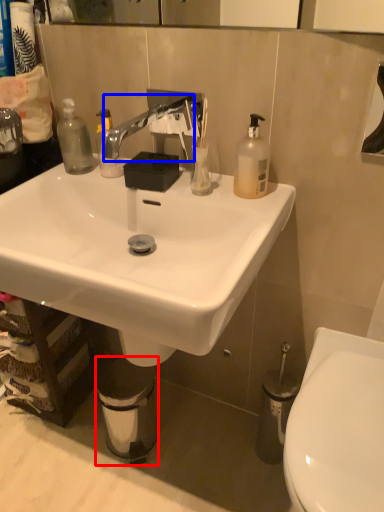
Question: Which of the following is the farthest to the observer, trash bin/can (highlighted by a red box) or faucet (highlighted by a blue box)?

Choices:
 (A) trash bin/can
 (B) faucet

Answer: (A)